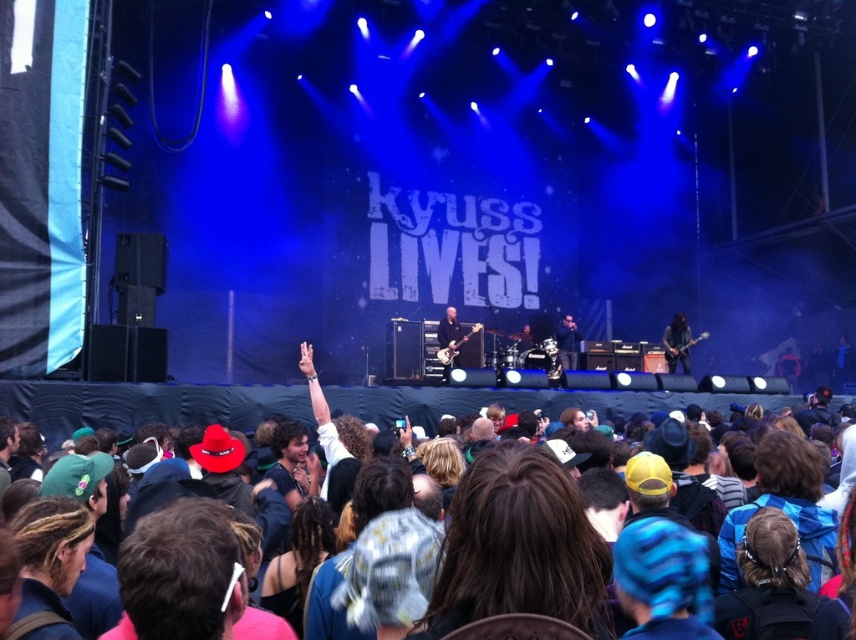
Consider the image. You are a stagehand who needs to move the black leather jacket at center to the left side of the stage. The matte black guitar at center is in the way. Can you move the guitar first to make space?

The distance between the matte black guitar at center and black leather jacket at center is 19.21 feet, so yes, you can move the matte black guitar at center first to create space before moving the black leather jacket at center to the left side of the stage.

You are a photographer at the concert and want to capture both the matte black guitar at center and the black leather jacket at center in a single shot. Since the camera can only focus on one object at a time, which object should you focus on to ensure it appears larger in the photo?

The matte black guitar at center is bigger than the black leather jacket at center, so you should focus on the matte black guitar at center to ensure it appears larger in the photo.

You are standing at the point closest to the stage in the concert venue. There are two points marked in the image, one at coordinates point (675, 317) and another at point (468, 333). Which of these points is farther away from you?

Point (675, 317) is behind point (468, 333), so the point farther away from you is point (675, 317).